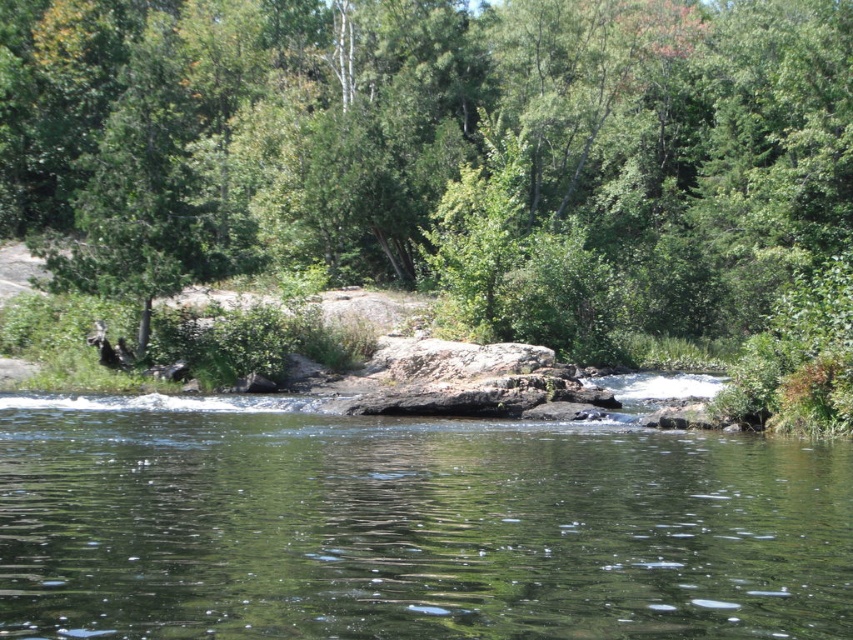
Is green leafy tree at center smaller than clear water at center?

Incorrect, green leafy tree at center is not smaller in size than clear water at center.

Between green leafy tree at center and clear water at center, which one has less height?

clear water at center

Which is behind, point (694, 145) or point (674, 451)?

Point (694, 145)

Where is `green leafy tree at center`? green leafy tree at center is located at coordinates (440, 150).